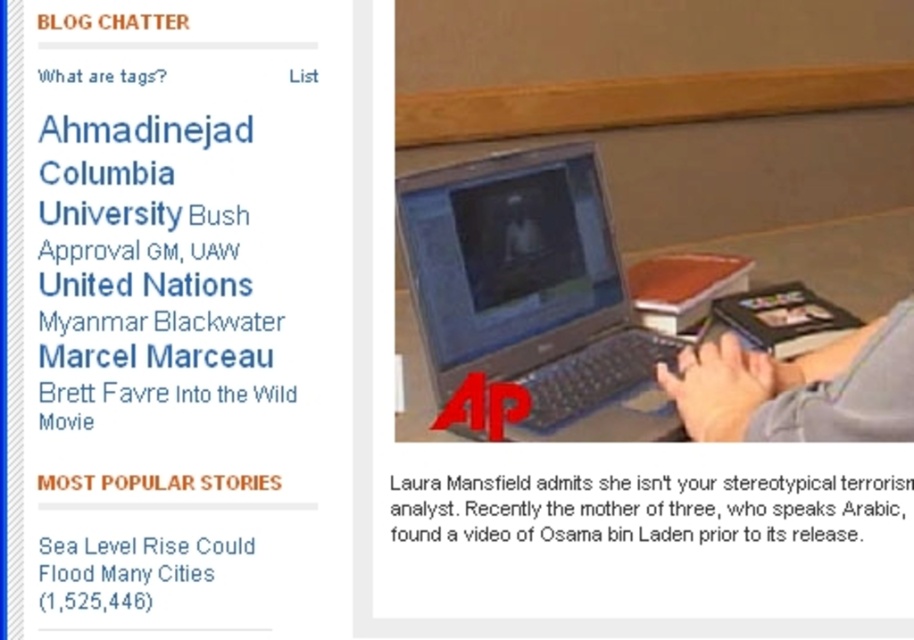
You are viewing a webpage layout and need to determine the spatial relationship between the matte plastic laptop at center and the white text on black background at upper left. Based on the scene description, which object is positioned to the right of the other?

The matte plastic laptop at center is to the right of white text on black background at upper left.

You are analyzing the layout of this webpage. There are two points marked on the image, point at coordinate (x=902, y=516) and point at coordinate (x=187, y=548). Which point is closer to the top of the page?

Point at coordinate (x=902, y=516) is closer to the camera than point at coordinate (x=187, y=548). Since the top of the page is closer to the camera in a typical webpage layout, the point closer to the camera would be nearer to the top. Therefore, point at coordinate (x=902, y=516) is closer to the top of the page.

You are organizing your desk and need to place the matte plastic laptop at center and the white paper at lower center. Based on their positions, which item is closer to the top edge of the desk?

The matte plastic laptop at center is closer to the top edge of the desk since it is located above the white paper at lower center.